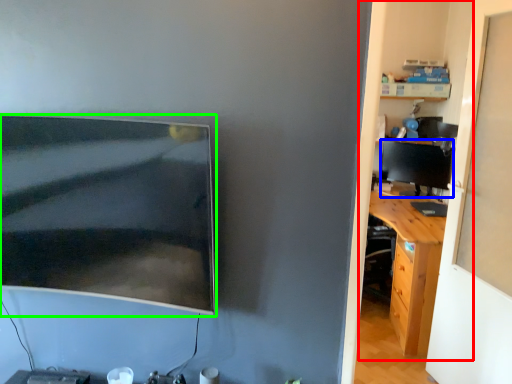
Question: Based on their relative distances, which object is farther from dresser (highlighted by a red box)? Choose from computer monitor (highlighted by a blue box) and computer monitor (highlighted by a green box).

Choices:
 (A) computer monitor
 (B) computer monitor

Answer: (B)